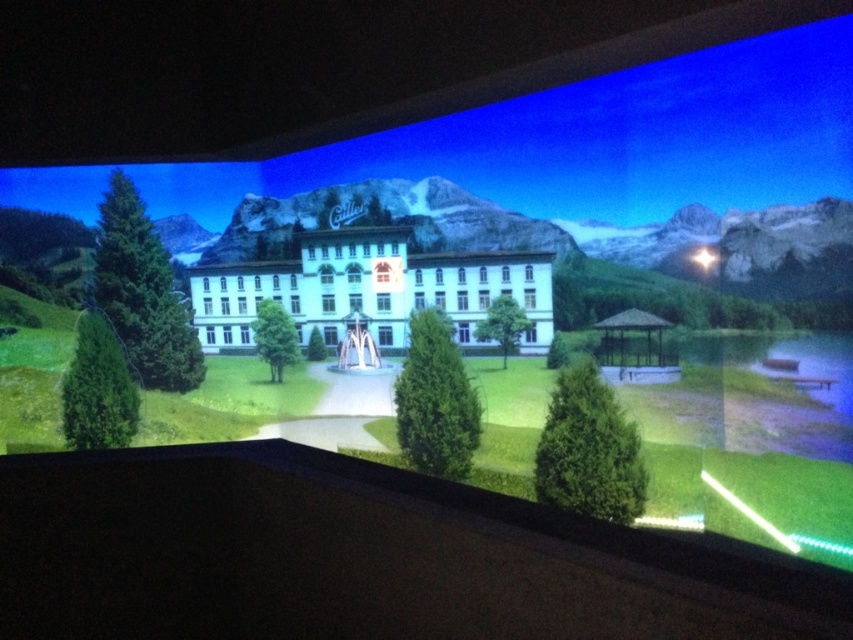
Question: Can you confirm if green grassy golf course at center is smaller than white glossy mountain at center?

Choices:
 (A) no
 (B) yes

Answer: (B)

Question: Which object is positioned closest to the white glossy building at center?

Choices:
 (A) white glossy mountain at center
 (B) green grassy golf course at center

Answer: (A)

Question: Is the position of white glossy mountain at center less distant than that of white glossy building at center?

Choices:
 (A) no
 (B) yes

Answer: (B)

Question: Which point appears farthest from the camera in this image?

Choices:
 (A) (370, 308)
 (B) (755, 337)

Answer: (A)

Question: Among these objects, which one is nearest to the camera?

Choices:
 (A) white glossy building at center
 (B) green grassy golf course at center

Answer: (B)

Question: Is green grassy golf course at center further to the viewer compared to white glossy mountain at center?

Choices:
 (A) no
 (B) yes

Answer: (A)